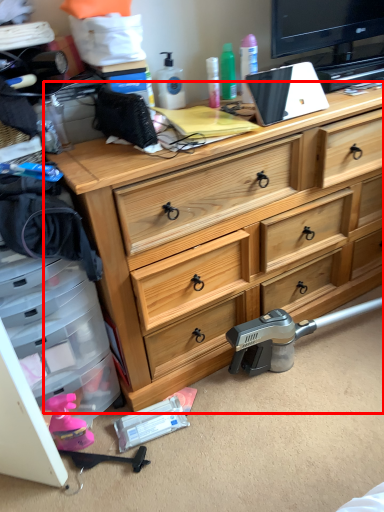
Question: From the image's perspective, considering the relative positions of chest of drawers (annotated by the red box) and weapon in the image provided, where is chest of drawers (annotated by the red box) located with respect to the staircase?

Choices:
 (A) above
 (B) below

Answer: (A)